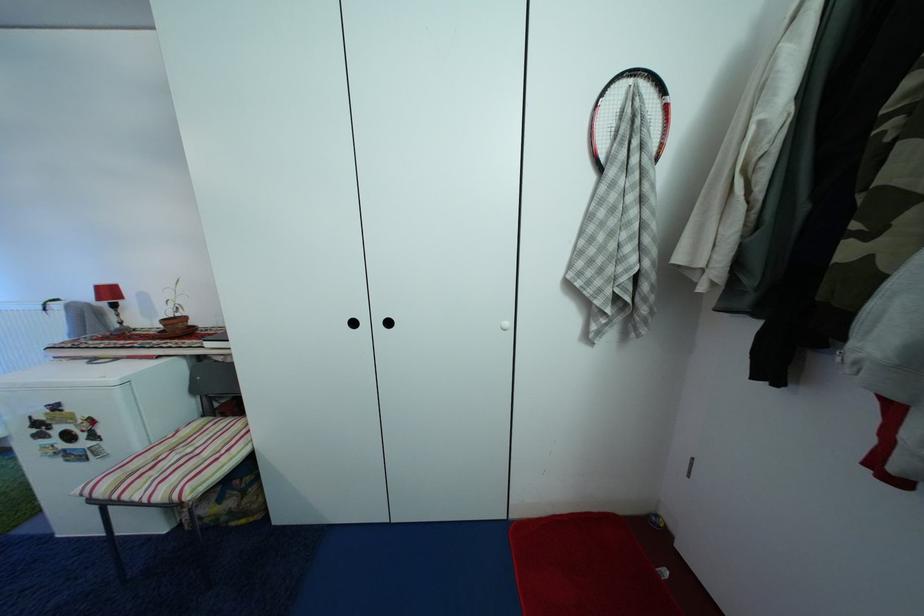
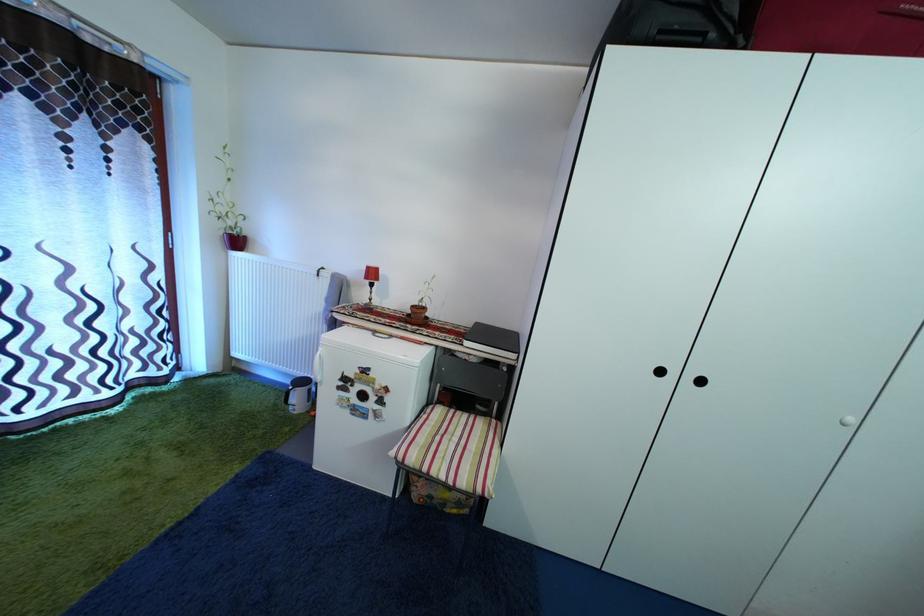
Question: In a continuous first-person perspective shot, in which direction is the camera moving?

Choices:
 (A) Left
 (B) Right
 (C) Forward
 (D) Backward

Answer: (A)